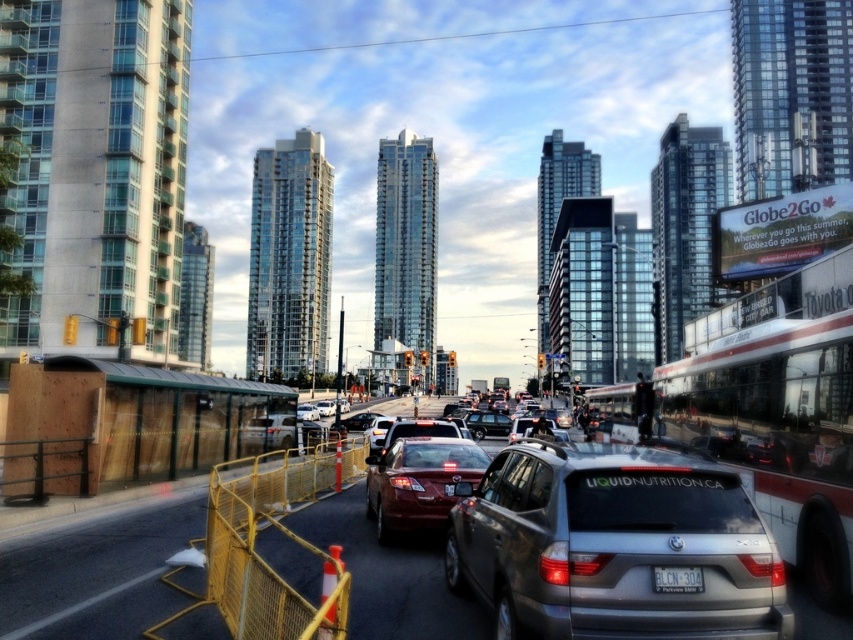
You are a pedestrian standing at the crosswalk and want to cross the street. There is a white plastic license plate at center and a shiny black sedan at center. Which object is closer to you?

The white plastic license plate at center is 35.78 meters away from the shiny black sedan at center. Since you are at the crosswalk, the shiny black sedan at center is closer to you than the license plate.

You are standing at the intersection and want to cross the street to reach the park located at the northern end of the street. There is a satin silver suv at center in your path. Based on its position, which direction should you move to avoid it?

The satin silver suv at center is located at point (613, 545), so you should move to the left or right to avoid it while crossing the street.

From the picture: You are a drone operator trying to capture aerial footage of the urban scene. You have two points marked in the image for reference. Which point, point 1 at coordinates (544, 563) or point 2 at coordinates (397, 468), is closer to the camera?

Point 1 at coordinates (544, 563) is closer to the camera than point 2 at coordinates (397, 468).